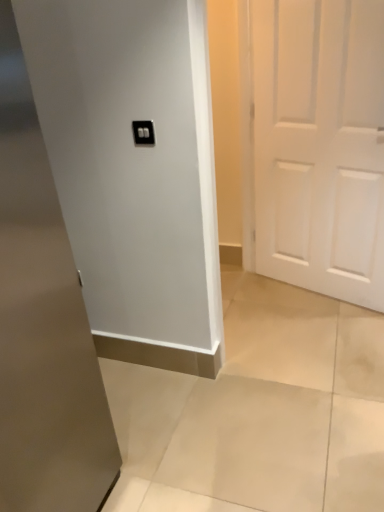
The width and height of the screenshot is (384, 512). What are the coordinates of `black plastic light switch at upper center` in the screenshot? It's located at pos(143,132).

Where is `black plastic light switch at upper center`? The height and width of the screenshot is (512, 384). black plastic light switch at upper center is located at coordinates (143, 132).

Is black plastic light switch at upper center oriented away from white matte door at right, acting as the first door starting from the back?

That's not correct — black plastic light switch at upper center is not looking away from white matte door at right, acting as the first door starting from the back.

Which of these two, black plastic light switch at upper center or white matte door at right, placed as the 1th door when sorted from right to left, stands shorter?

black plastic light switch at upper center.

In the scene shown: How much distance is there between black plastic light switch at upper center and white matte door at right, acting as the first door starting from the back?

A distance of 3.59 feet exists between black plastic light switch at upper center and white matte door at right, acting as the first door starting from the back.

Does point (135, 130) lie behind point (369, 170)?

No, it is in front of (369, 170).

From the image's perspective, is white matte door at right, arranged as the second door when viewed from the front, located above black plastic light switch at upper center?

Yes, from the image's perspective, white matte door at right, arranged as the second door when viewed from the front, is above black plastic light switch at upper center.

Which object is positioned more to the left, white matte door at right, acting as the first door starting from the back, or black plastic light switch at upper center?

black plastic light switch at upper center is more to the left.

Which point is more distant from viewer, (325, 293) or (148, 141)?

Point (325, 293)

From a real-world perspective, between white matte door at right, placed as the 1th door when sorted from right to left, and black plastic light switch at upper center, who is vertically higher?

From a 3D spatial view, black plastic light switch at upper center is above.

Based on the photo, looking at the image, does white glossy door at center, the second door when ordered from back to front, seem bigger or smaller compared to black plastic light switch at upper center?

Clearly, white glossy door at center, the second door when ordered from back to front, is larger in size than black plastic light switch at upper center.

Is white glossy door at center, marked as the 2th door in a right-to-left arrangement, further to the viewer compared to black plastic light switch at upper center?

No, the depth of white glossy door at center, marked as the 2th door in a right-to-left arrangement, is less than that of black plastic light switch at upper center.

Who is shorter, white glossy door at center, the first door viewed from the front, or black plastic light switch at upper center?

With less height is black plastic light switch at upper center.

Does beige polished concrete at lower center have a greater width compared to white matte door at right, which is the second door from left to right?

Yes.

From the picture: From the image's perspective, which one is positioned lower, beige polished concrete at lower center or white matte door at right, arranged as the second door when viewed from the front?

From the image's view, beige polished concrete at lower center is below.

There is a beige polished concrete at lower center. Identify the location of the 2nd door above it (from the image's perspective). (320, 145).

Does point (296, 444) come behind point (327, 222)?

No, it is not.

From a real-world perspective, who is located higher, white glossy door at center, the second door when ordered from back to front, or white matte door at right, arranged as the second door when viewed from the front?

In real-world perspective, white matte door at right, arranged as the second door when viewed from the front, is above.

Is point (70, 345) closer to camera compared to point (350, 106)?

Yes, it is in front of point (350, 106).

Which is behind, white glossy door at center, the second door when ordered from back to front, or white matte door at right, placed as the 1th door when sorted from right to left?

white matte door at right, placed as the 1th door when sorted from right to left, is more distant.

From the image's perspective, is white glossy door at center, the 1th door from the left, located above or below white matte door at right, acting as the first door starting from the back?

Answer: white glossy door at center, the 1th door from the left, is situated lower than white matte door at right, acting as the first door starting from the back, in the image.

In the scene shown: Considering the relative sizes of white matte door at right, arranged as the second door when viewed from the front, and white glossy door at center, the first door viewed from the front, in the image provided, is white matte door at right, arranged as the second door when viewed from the front, thinner than white glossy door at center, the first door viewed from the front,?

Answer: Yes, white matte door at right, arranged as the second door when viewed from the front, is thinner than white glossy door at center, the first door viewed from the front.

In terms of size, does white matte door at right, placed as the 1th door when sorted from right to left, appear bigger or smaller than white glossy door at center, the 1th door from the left?

white matte door at right, placed as the 1th door when sorted from right to left, is smaller than white glossy door at center, the 1th door from the left.

Between white matte door at right, acting as the first door starting from the back, and white glossy door at center, the 1th door from the left, which one has less height?

With less height is white glossy door at center, the 1th door from the left.

Consider the image. Is the surface of white matte door at right, which is the second door from left to right, in direct contact with white glossy door at center, the 1th door from the left?

No, white matte door at right, which is the second door from left to right, is not in contact with white glossy door at center, the 1th door from the left.

From a real-world perspective, is white glossy door at center, the 1th door from the left, located beneath beige polished concrete at lower center?

Actually, white glossy door at center, the 1th door from the left, is physically above beige polished concrete at lower center in the real world.

Is white glossy door at center, marked as the 2th door in a right-to-left arrangement, wider than beige polished concrete at lower center?

In fact, white glossy door at center, marked as the 2th door in a right-to-left arrangement, might be narrower than beige polished concrete at lower center.

Considering the positions of objects white glossy door at center, marked as the 2th door in a right-to-left arrangement, and beige polished concrete at lower center in the image provided, who is more to the left, white glossy door at center, marked as the 2th door in a right-to-left arrangement, or beige polished concrete at lower center?

white glossy door at center, marked as the 2th door in a right-to-left arrangement, is more to the left.

Is white glossy door at center, the 1th door from the left, oriented away from beige polished concrete at lower center?

No, white glossy door at center, the 1th door from the left, is not facing away from beige polished concrete at lower center.

From a real-world perspective, count 1st doors downward from the black plastic light switch at upper center and point to it. Please provide its 2D coordinates.

[(320, 145)]

The image size is (384, 512). In order to click on door above the black plastic light switch at upper center (from the image's perspective) in this screenshot , I will do `click(320, 145)`.

Consider the image. Estimate the real-world distances between objects in this image. Which object is closer to white glossy door at center, the 1th door from the left, white matte door at right, placed as the 1th door when sorted from right to left, or black plastic light switch at upper center?

Based on the image, black plastic light switch at upper center appears to be nearer to white glossy door at center, the 1th door from the left.

When comparing their distances from black plastic light switch at upper center, does beige polished concrete at lower center or white glossy door at center, the first door viewed from the front, seem closer?

white glossy door at center, the first door viewed from the front, lies closer to black plastic light switch at upper center than the other object.

Estimate the real-world distances between objects in this image. Which object is further from white matte door at right, acting as the first door starting from the back, white glossy door at center, the 1th door from the left, or beige polished concrete at lower center?

Based on the image, white glossy door at center, the 1th door from the left, appears to be further to white matte door at right, acting as the first door starting from the back.

From the image, which object appears to be nearer to black plastic light switch at upper center, white glossy door at center, the 1th door from the left, or white matte door at right, arranged as the second door when viewed from the front?

The object closer to black plastic light switch at upper center is white glossy door at center, the 1th door from the left.

From the image, which object appears to be farther from white matte door at right, placed as the 1th door when sorted from right to left, black plastic light switch at upper center or white glossy door at center, the second door when ordered from back to front?

Among the two, white glossy door at center, the second door when ordered from back to front, is located further to white matte door at right, placed as the 1th door when sorted from right to left.

From the image, which object appears to be nearer to black plastic light switch at upper center, beige polished concrete at lower center or white matte door at right, acting as the first door starting from the back?

white matte door at right, acting as the first door starting from the back, is closer to black plastic light switch at upper center.

When comparing their distances from white matte door at right, arranged as the second door when viewed from the front, does black plastic light switch at upper center or beige polished concrete at lower center seem further?

black plastic light switch at upper center is positioned further to the anchor white matte door at right, arranged as the second door when viewed from the front.

Considering their positions, is beige polished concrete at lower center positioned further to white glossy door at center, the first door viewed from the front, than white matte door at right, acting as the first door starting from the back?

The object further to white glossy door at center, the first door viewed from the front, is white matte door at right, acting as the first door starting from the back.

Where is `light switch between white glossy door at center, the 1th door from the left, and beige polished concrete at lower center`? This screenshot has width=384, height=512. light switch between white glossy door at center, the 1th door from the left, and beige polished concrete at lower center is located at coordinates (143, 132).

The height and width of the screenshot is (512, 384). Identify the location of concrete between white glossy door at center, the 1th door from the left, and white matte door at right, arranged as the second door when viewed from the front, from left to right. (259, 411).

In order to click on light switch between white matte door at right, acting as the first door starting from the back, and beige polished concrete at lower center from top to bottom in this screenshot , I will do `click(143, 132)`.

The image size is (384, 512). I want to click on light switch located between white glossy door at center, the second door when ordered from back to front, and white matte door at right, acting as the first door starting from the back, in the left-right direction, so click(x=143, y=132).